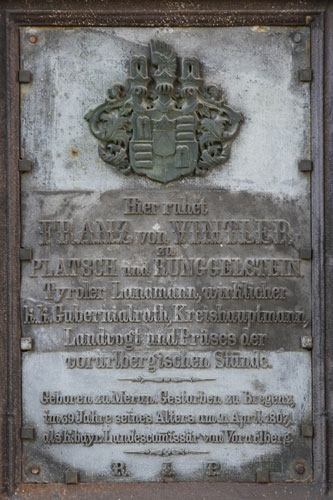
You are a GUI agent. You are given a task and a screenshot of the screen. Output one action in this format:
    pyautogui.click(x=<x>, y=<y>)
    Task: Click on the frame
    
    Given the screenshot: What is the action you would take?
    pyautogui.click(x=68, y=10)